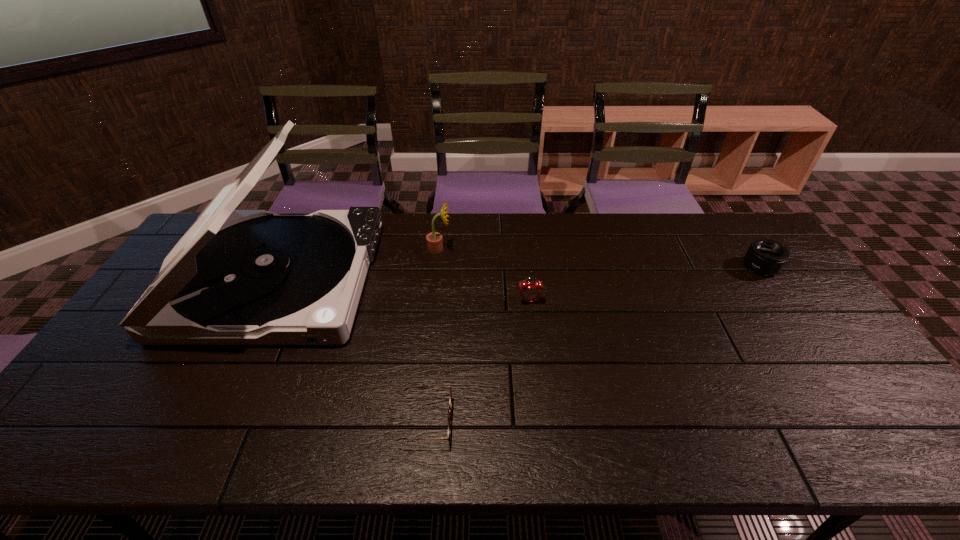
Identify the location of free space that satisfies the following two spatial constraints: 1. on the face of the alarm clock; 2. at the front view of the shortest object. (542, 421).

The width and height of the screenshot is (960, 540). Find the location of `vacant space that satisfies the following two spatial constraints: 1. on the face of the fourth object from left to right; 2. at the front view of the shortest object`. vacant space that satisfies the following two spatial constraints: 1. on the face of the fourth object from left to right; 2. at the front view of the shortest object is located at coordinates (542, 421).